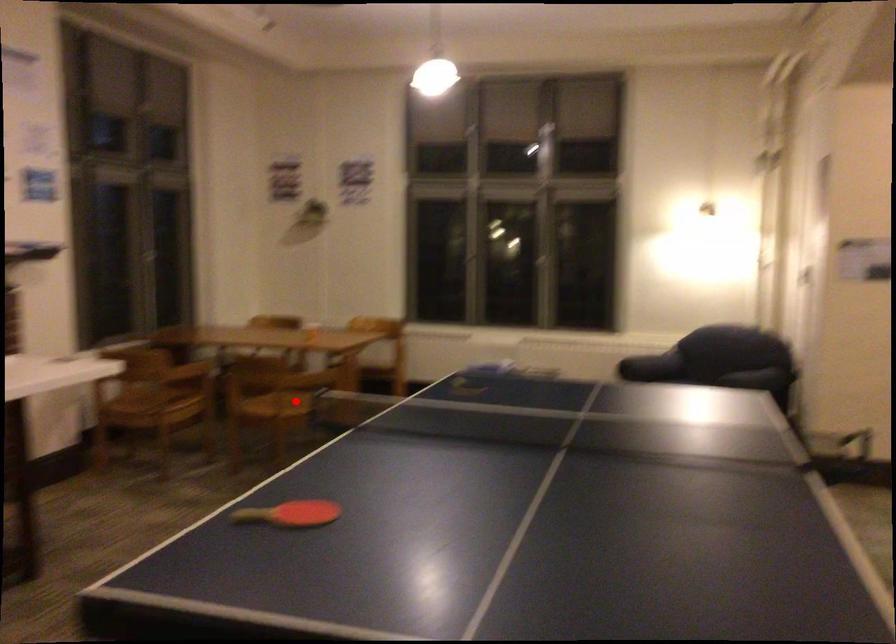
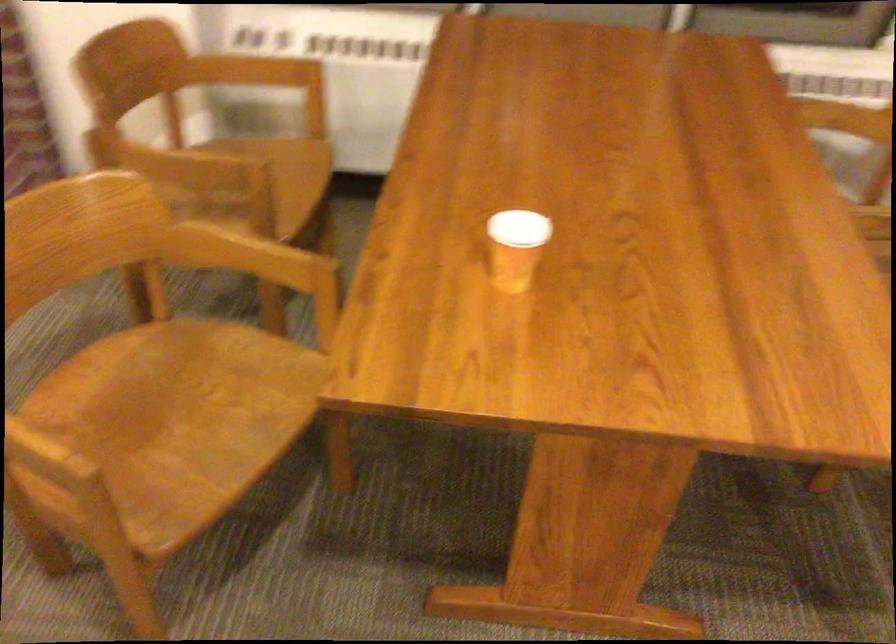
Question: I am providing you with two images of the same scene from different viewpoints. Given a red point in image1, look at the same physical point in image2. Is it:

Choices:
 (A) Closer to the viewpoint
 (B) Farther from the viewpoint

Answer: (A)